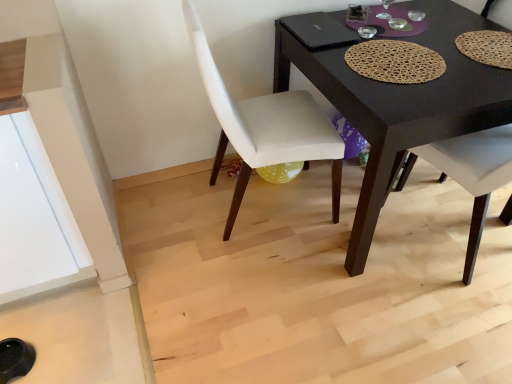
Image resolution: width=512 pixels, height=384 pixels. I want to click on free space that is in between black matte desk at center and white fabric chair at center, arranged as the 1th chair when viewed from the left, so click(286, 248).